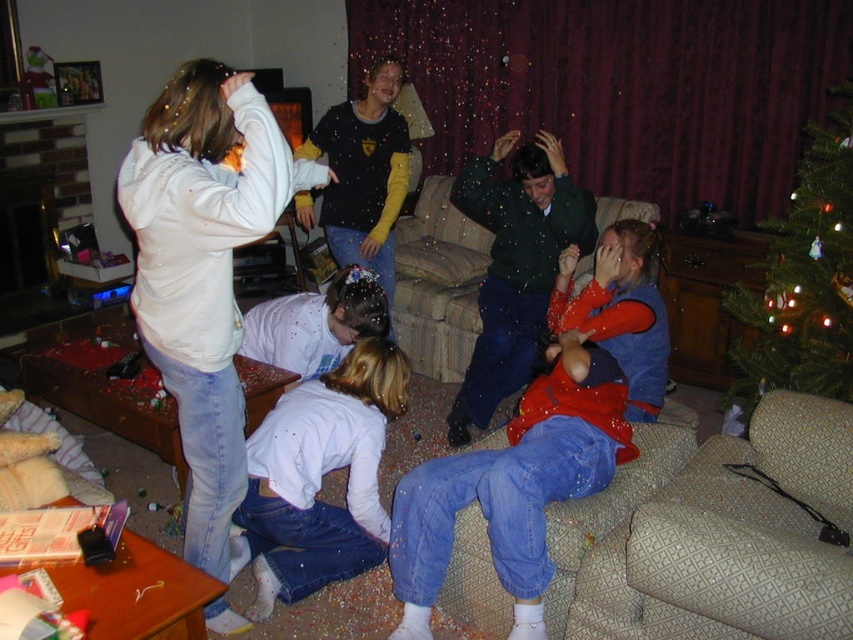
Question: Which object is closer to the camera taking this photo?

Choices:
 (A) matte black shirt at center
 (B) matte white hoodie at upper left
 (C) denim couch at lower right

Answer: (C)

Question: Which point is closer to the camera taking this photo?

Choices:
 (A) (537, 237)
 (B) (352, 392)
 (C) (752, 346)
 (D) (660, 314)

Answer: (B)

Question: Estimate the real-world distances between objects in this image. Which object is closer to the matte black shirt at center?

Choices:
 (A) white soft shirt at lower center
 (B) matte white hoodie at upper left
 (C) dark green sweater at center

Answer: (C)

Question: Is green textured christmas tree at upper right bigger than matte black shirt at center?

Choices:
 (A) yes
 (B) no

Answer: (A)

Question: Can you confirm if denim couch at lower right is thinner than dark green sweater at center?

Choices:
 (A) yes
 (B) no

Answer: (B)

Question: Does matte white hoodie at upper left appear under dark green sweater at center?

Choices:
 (A) yes
 (B) no

Answer: (A)